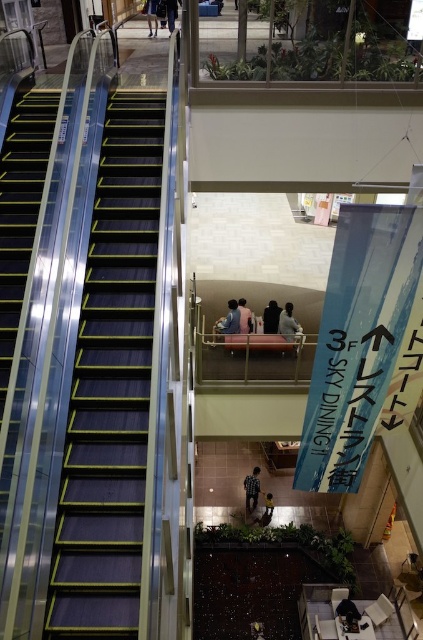
Question: Can you confirm if light blue shirt at center is smaller than dark blue shirt at lower center?

Choices:
 (A) no
 (B) yes

Answer: (A)

Question: Is light pink fabric at center below dark blue jeans at upper center?

Choices:
 (A) no
 (B) yes

Answer: (B)

Question: Which object is the closest to the metallic escalator steps at left?

Choices:
 (A) dark blue jeans at upper center
 (B) dark brown leather jacket at center
 (C) light blue fabric jacket at center
 (D) dark blue shirt at lower center

Answer: (C)

Question: Does light blue fabric jacket at center appear on the right side of dark brown leather jacket at center?

Choices:
 (A) yes
 (B) no

Answer: (B)

Question: Which of the following is the farthest from the observer?

Choices:
 (A) metallic escalator steps at left
 (B) dark blue jeans at upper center

Answer: (B)

Question: Which object is farther from the camera taking this photo?

Choices:
 (A) light pink fabric at center
 (B) light blue shirt at center

Answer: (A)